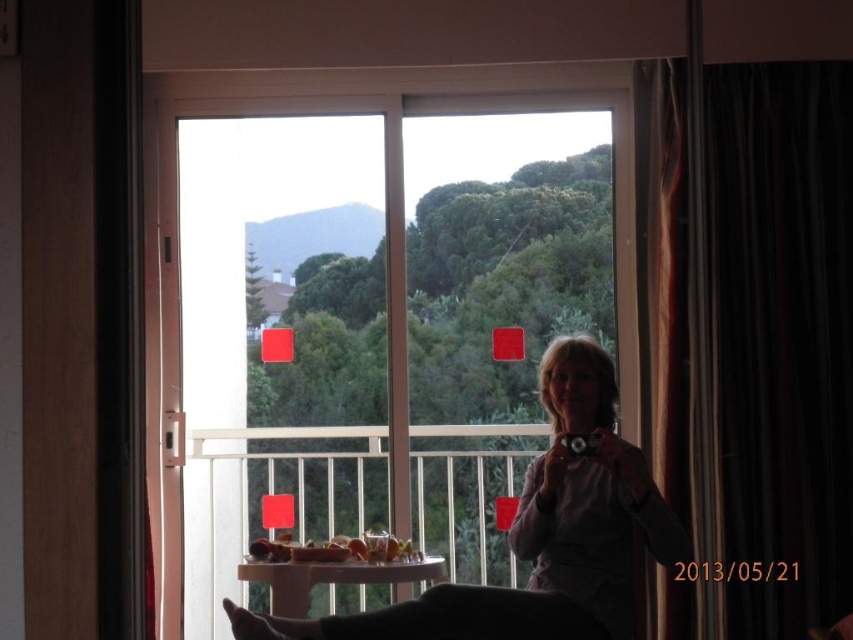
Question: Does transparent glass door at center appear on the right side of green matte mountain at upper left?

Choices:
 (A) no
 (B) yes

Answer: (B)

Question: Which point is closer to the camera taking this photo?

Choices:
 (A) (659, 502)
 (B) (392, 202)
 (C) (724, 524)

Answer: (C)

Question: Which of these objects is positioned farthest from the white plastic table at center?

Choices:
 (A) transparent glass door at center
 (B) matte purple shirt at center
 (C) green matte mountain at upper left

Answer: (C)

Question: Which of the following is the closest to the observer?

Choices:
 (A) black velvet curtain at right
 (B) white plastic table at center
 (C) transparent glass door at center
 (D) matte purple shirt at center

Answer: (A)

Question: Can you confirm if transparent glass door at center is thinner than green matte mountain at upper left?

Choices:
 (A) no
 (B) yes

Answer: (A)

Question: Is matte purple shirt at center to the left of green matte mountain at upper left from the viewer's perspective?

Choices:
 (A) no
 (B) yes

Answer: (A)